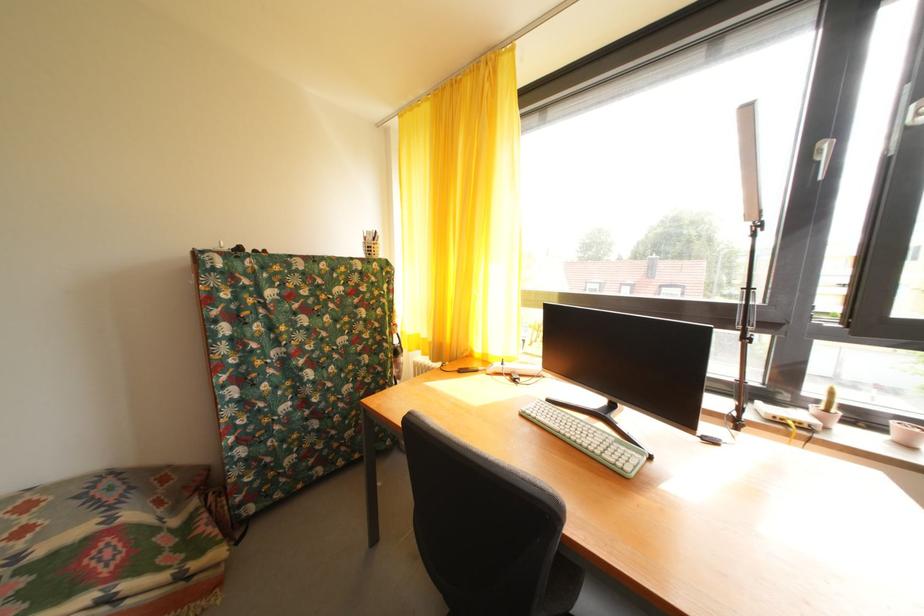
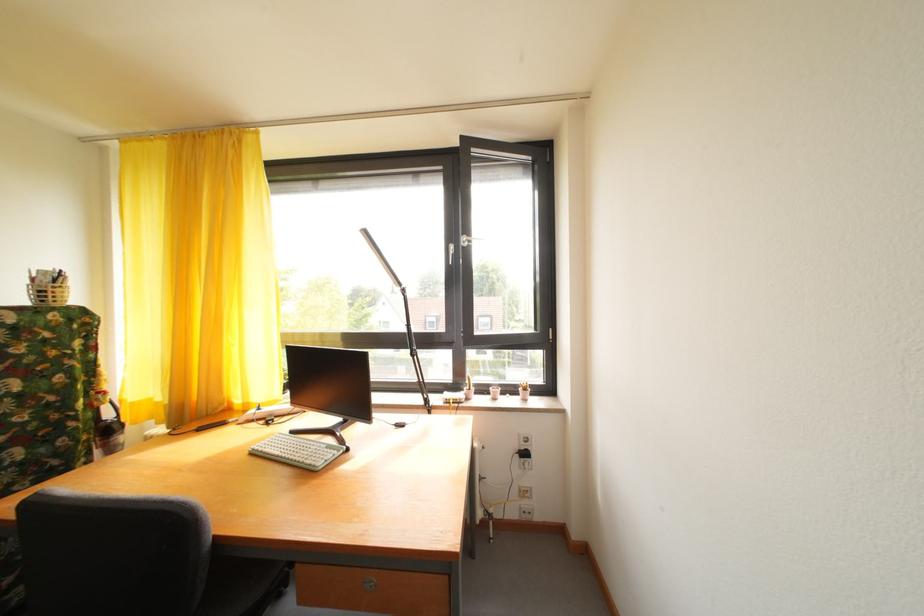
In the second image, find the point that corresponds to point (870, 424) in the first image.

(492, 395)